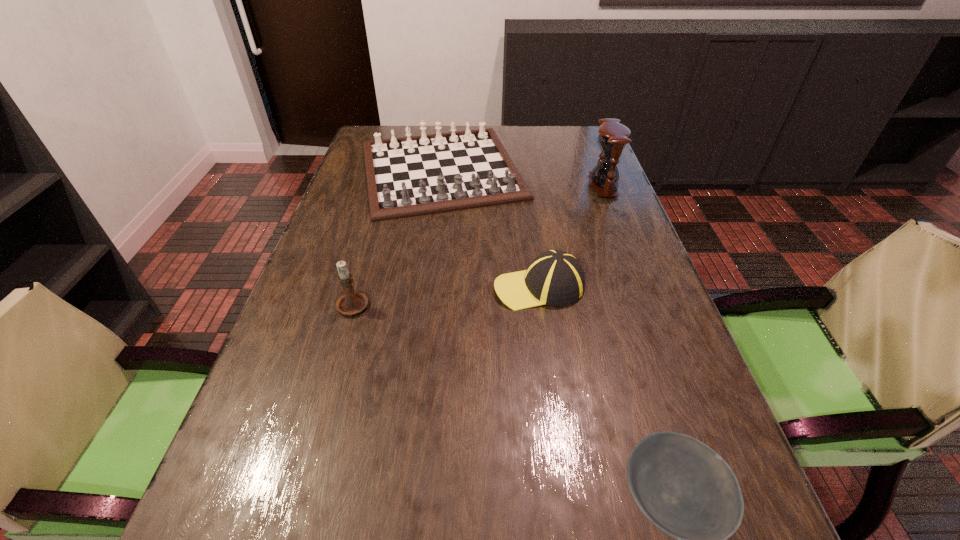
At what (x,y) coordinates should I click in order to perform the action: click on hourglass. Please return your answer as a coordinate pair (x, y). Looking at the image, I should click on (613, 136).

Find the location of a particular element. This screenshot has height=540, width=960. the second tallest object is located at coordinates (351, 303).

Locate an element on the screen. chessboard is located at coordinates pos(410,176).

Where is `baseball cap`? Image resolution: width=960 pixels, height=540 pixels. baseball cap is located at coordinates (x=555, y=277).

The height and width of the screenshot is (540, 960). Identify the location of vacant region located 0.390m on the left of the tallest object. (458, 185).

What are the coordinates of `blank space located 0.270m on the side of the candle holder with the handle` in the screenshot? It's located at (378, 219).

The height and width of the screenshot is (540, 960). I want to click on vacant area located 0.400m on the side of the candle holder with the handle, so click(x=385, y=193).

You are a GUI agent. You are given a task and a screenshot of the screen. Output one action in this format:
    pyautogui.click(x=<x>, y=<y>)
    Task: Click on the vacant region located on the side of the candle holder with the handle
    This screenshot has height=540, width=960.
    Given the screenshot: What is the action you would take?
    pyautogui.click(x=384, y=199)

Where is `free region located 0.330m on the front of the chessboard`? This screenshot has width=960, height=540. free region located 0.330m on the front of the chessboard is located at coordinates (422, 314).

Identify the location of free region located 0.240m with the brim of the baseball cap facing forward. (388, 287).